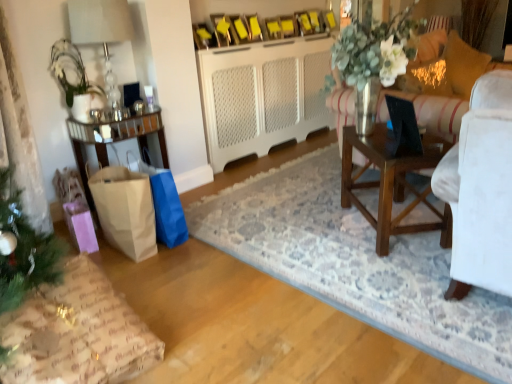
Question: Considering the relative sizes of black plastic laptop at right and gold textured pillow at upper right, placed as the 1th pillow when sorted from right to left, in the image provided, is black plastic laptop at right thinner than gold textured pillow at upper right, placed as the 1th pillow when sorted from right to left,?

Choices:
 (A) no
 (B) yes

Answer: (B)

Question: Is black plastic laptop at right placed right next to gold textured pillow at upper right, placed as the 1th pillow when sorted from right to left?

Choices:
 (A) no
 (B) yes

Answer: (A)

Question: From a real-world perspective, is black plastic laptop at right on top of gold textured pillow at upper right, which appears as the 2th pillow when viewed from the left?

Choices:
 (A) no
 (B) yes

Answer: (A)

Question: Could you tell me if black plastic laptop at right is turned towards gold textured pillow at upper right, placed as the 1th pillow when sorted from right to left?

Choices:
 (A) yes
 (B) no

Answer: (B)

Question: Is black plastic laptop at right turned away from gold textured pillow at upper right, placed as the 1th pillow when sorted from right to left?

Choices:
 (A) no
 (B) yes

Answer: (A)

Question: In terms of height, does brown paper bag at lower left, the 1th shopping bag from the right, look taller or shorter compared to brown wooden table at center, which ranks as the 1th table in right-to-left order?

Choices:
 (A) short
 (B) tall

Answer: (B)

Question: From a real-world perspective, is brown paper bag at lower left, the 1th shopping bag from the right, above or below brown wooden table at center, the second table in the left-to-right sequence?

Choices:
 (A) below
 (B) above

Answer: (A)

Question: Is point (163, 196) positioned closer to the camera than point (425, 160)?

Choices:
 (A) farther
 (B) closer

Answer: (A)

Question: From the image's perspective, is brown paper bag at lower left, the 1th shopping bag from the right, positioned above or below brown wooden table at center, the second table in the left-to-right sequence?

Choices:
 (A) below
 (B) above

Answer: (A)

Question: Is wrapping paper gift at lower left situated inside brown paper bag at lower left, the 1th shopping bag positioned from the left, or outside?

Choices:
 (A) inside
 (B) outside

Answer: (B)

Question: From a real-world perspective, relative to brown paper bag at lower left, the 1th shopping bag positioned from the left, is wrapping paper gift at lower left vertically above or below?

Choices:
 (A) above
 (B) below

Answer: (B)

Question: Looking at their shapes, would you say wrapping paper gift at lower left is wider or thinner than brown paper bag at lower left, the 2th shopping bag when ordered from right to left?

Choices:
 (A) wide
 (B) thin

Answer: (A)

Question: Is point click(x=31, y=369) positioned closer to the camera than point click(x=109, y=167)?

Choices:
 (A) farther
 (B) closer

Answer: (B)

Question: Is black plastic laptop at right to the left or to the right of brown paper bag at lower left, positioned as the 2th shopping bag in left-to-right order, in the image?

Choices:
 (A) left
 (B) right

Answer: (B)

Question: In the image, is black plastic laptop at right positioned in front of or behind brown paper bag at lower left, the 1th shopping bag from the right?

Choices:
 (A) front
 (B) behind

Answer: (A)